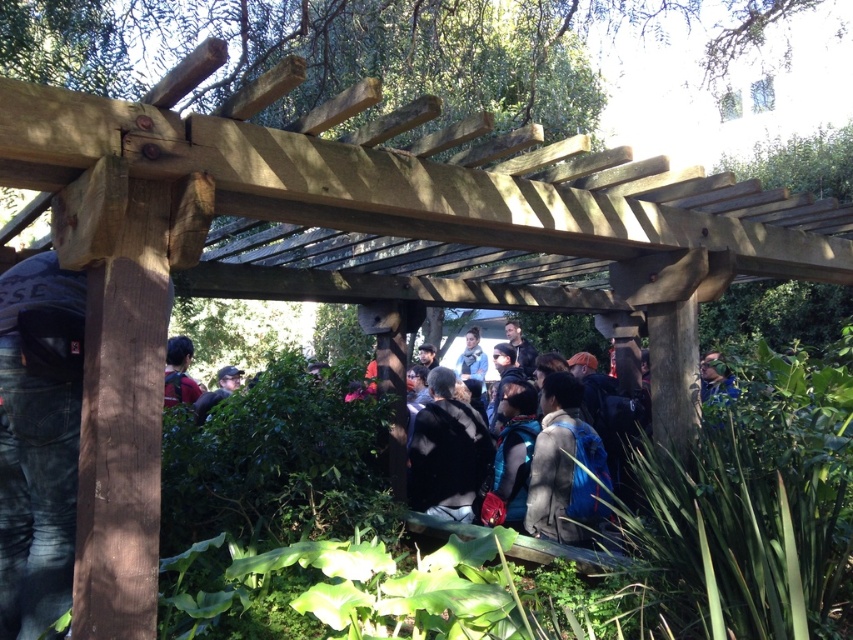
You are standing at the entrance of the pergola and want to hand a pamphlet to the person wearing the gray fabric jacket at center. However, there is a matte black backpack at left blocking your path. Can you reach the person without moving the backpack?

The gray fabric jacket at center is in front of the matte black backpack at left, so you can reach the person wearing the gray fabric jacket at center without moving the backpack since the jacket is already positioned in front of it.

You are a photographer trying to capture a clear shot of the matte black backpack at left without any obstructions. Given the dark green foliage at center, will you be able to take the photo without the foliage blocking the backpack?

The dark green foliage at center is taller than the matte black backpack at left, so it may obstruct the view of the backpack. Adjust your angle or position to ensure the backpack is visible without the taller foliage blocking it.

You are standing under the wooden pergola and want to take a photo of the dark green foliage at center without the matte black backpack at left appearing in the frame. How should you adjust your position?

Move forward towards the dark green foliage at center so it stays in view while the matte black backpack at left moves out of the frame since the dark green foliage at center is closer to you than the matte black backpack at left.